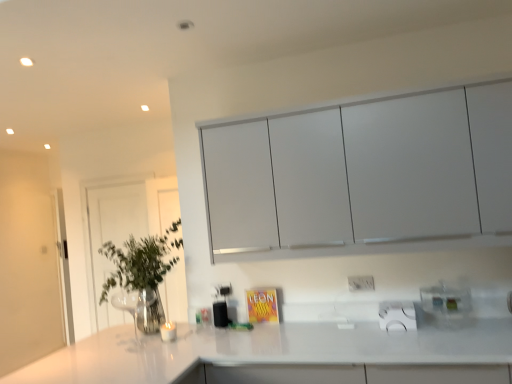
The image size is (512, 384). Describe the element at coordinates (284, 356) in the screenshot. I see `white glossy countertop at center` at that location.

Describe the element at coordinates (142, 273) in the screenshot. I see `clear glass vase at left` at that location.

Describe the element at coordinates (112, 236) in the screenshot. This screenshot has height=384, width=512. I see `clear glass door at left` at that location.

At what (x,y) coordinates should I click in order to perform the action: click on white plastic electric outlet at center. Please return your answer as a coordinate pair (x, y). Image resolution: width=512 pixels, height=384 pixels. Looking at the image, I should click on (361, 283).

You are a GUI agent. You are given a task and a screenshot of the screen. Output one action in this format:
    pyautogui.click(x=<x>, y=<y>)
    Task: Click on the glass door located below the white plastic electric outlet at center (from the image's perspective)
    Image resolution: width=512 pixels, height=384 pixels.
    Given the screenshot: What is the action you would take?
    pyautogui.click(x=112, y=236)

Can you see white plastic electric outlet at center touching clear glass door at left?

white plastic electric outlet at center and clear glass door at left are not in contact.

Is white plastic electric outlet at center facing away from clear glass door at left?

white plastic electric outlet at center does not have its back to clear glass door at left.

How many degrees apart are the facing directions of clear plastic spice rack at lower right and white plastic electric outlet at center?

The facing directions of clear plastic spice rack at lower right and white plastic electric outlet at center are 1.85 degrees apart.

Considering the sizes of clear plastic spice rack at lower right and white plastic electric outlet at center in the image, is clear plastic spice rack at lower right taller or shorter than white plastic electric outlet at center?

clear plastic spice rack at lower right is taller than white plastic electric outlet at center.

Which object is further away from the camera taking this photo, clear plastic spice rack at lower right or white plastic electric outlet at center?

white plastic electric outlet at center is behind.

Are clear glass door at left and clear glass vase at left far apart?

Yes, clear glass door at left and clear glass vase at left are quite far apart.

From the image's perspective, which one is positioned higher, clear glass door at left or clear glass vase at left?

From the image's view, clear glass vase at left is above.

Considering the sizes of clear glass door at left and clear glass vase at left in the image, is clear glass door at left wider or thinner than clear glass vase at left?

In the image, clear glass door at left appears to be more narrow than clear glass vase at left.

From a real-world perspective, who is located lower, clear glass door at left or clear glass vase at left?

In real-world perspective, clear glass door at left is lower.

Is clear glass door at left positioned with its back to white glossy countertop at center?

That's not correct — clear glass door at left is not looking away from white glossy countertop at center.

Can you confirm if clear glass door at left is thinner than white glossy countertop at center?

Indeed, clear glass door at left has a lesser width compared to white glossy countertop at center.

From a real-world perspective, is clear glass door at left on top of white glossy countertop at center?

Indeed, from a real-world perspective, clear glass door at left stands above white glossy countertop at center.

Consider the image. From the image's perspective, which is below, white plastic electric outlet at center or white glossy countertop at center?

white glossy countertop at center is shown below in the image.

Between white plastic electric outlet at center and white glossy countertop at center, which one has smaller width?

Thinner between the two is white plastic electric outlet at center.

Is white plastic electric outlet at center to the left or to the right of white glossy countertop at center in the image?

From the image, it's evident that white plastic electric outlet at center is to the right of white glossy countertop at center.

Based on their sizes in the image, would you say white plastic electric outlet at center is bigger or smaller than white glossy countertop at center?

Considering their sizes, white plastic electric outlet at center takes up less space than white glossy countertop at center.

Considering the sizes of objects clear glass vase at left and white plastic electric outlet at center in the image provided, who is smaller, clear glass vase at left or white plastic electric outlet at center?

Smaller between the two is white plastic electric outlet at center.

Measure the distance from clear glass vase at left to white plastic electric outlet at center.

clear glass vase at left and white plastic electric outlet at center are 4.35 feet apart.

How different are the orientations of clear glass vase at left and white plastic electric outlet at center in degrees?

They differ by 88.3 degrees in their facing directions.

From a real-world perspective, which object rests below the other?

In real-world perspective, white plastic electric outlet at center is lower.

Based on the photo, can you confirm if clear glass vase at left is positioned to the left of white glossy countertop at center?

Yes, clear glass vase at left is to the left of white glossy countertop at center.

Considering the positions of point (158, 266) and point (25, 369), is point (158, 266) closer or farther from the camera than point (25, 369)?

Point (158, 266) appears to be farther away from the viewer than point (25, 369).

Looking at this image, looking at their sizes, would you say clear glass vase at left is wider or thinner than white glossy countertop at center?

clear glass vase at left is thinner than white glossy countertop at center.

From a real-world perspective, does clear glass vase at left sit lower than white glossy countertop at center?

Incorrect, from a real-world perspective, clear glass vase at left is higher than white glossy countertop at center.

This screenshot has width=512, height=384. In order to click on glass door located below the white plastic electric outlet at center (from the image's perspective) in this screenshot , I will do `click(112, 236)`.

You are a GUI agent. You are given a task and a screenshot of the screen. Output one action in this format:
    pyautogui.click(x=<x>, y=<y>)
    Task: Click on the appliance located in front of the white plastic electric outlet at center
    The height and width of the screenshot is (384, 512).
    Given the screenshot: What is the action you would take?
    pyautogui.click(x=447, y=304)

Based on their spatial positions, is white glossy countertop at center or clear plastic spice rack at lower right closer to clear glass vase at left?

white glossy countertop at center lies closer to clear glass vase at left than the other object.

Looking at the image, which one is located closer to white glossy countertop at center, clear plastic spice rack at lower right or clear glass door at left?

clear plastic spice rack at lower right lies closer to white glossy countertop at center than the other object.

Looking at this image, considering their positions, is clear glass door at left positioned further to clear plastic spice rack at lower right than clear glass vase at left?

clear glass door at left lies further to clear plastic spice rack at lower right than the other object.

Looking at the image, which one is located further to white matte cabinet at upper center, white glossy countertop at center or clear glass vase at left?

clear glass vase at left.

Considering their positions, is white plastic electric outlet at center positioned closer to white glossy countertop at center than clear plastic spice rack at lower right?

clear plastic spice rack at lower right.

Consider the image. When comparing their distances from white matte cabinet at upper center, does white glossy countertop at center or clear plastic spice rack at lower right seem closer?

clear plastic spice rack at lower right.

Based on their spatial positions, is clear plastic spice rack at lower right or white glossy countertop at center further from clear glass door at left?

clear plastic spice rack at lower right.

Looking at the image, which one is located closer to white glossy countertop at center, clear plastic spice rack at lower right or white plastic electric outlet at center?

Among the two, clear plastic spice rack at lower right is located nearer to white glossy countertop at center.

The height and width of the screenshot is (384, 512). What are the coordinates of `houseplant between clear glass door at left and clear plastic spice rack at lower right in the horizontal direction` in the screenshot? It's located at (142, 273).

Image resolution: width=512 pixels, height=384 pixels. I want to click on appliance between white glossy countertop at center and clear glass door at left along the z-axis, so click(447, 304).

The width and height of the screenshot is (512, 384). I want to click on appliance between white matte cabinet at upper center and white glossy countertop at center in the up-down direction, so click(x=447, y=304).

Where is `houseplant between clear glass door at left and white plastic electric outlet at center`? The image size is (512, 384). houseplant between clear glass door at left and white plastic electric outlet at center is located at coordinates (142, 273).